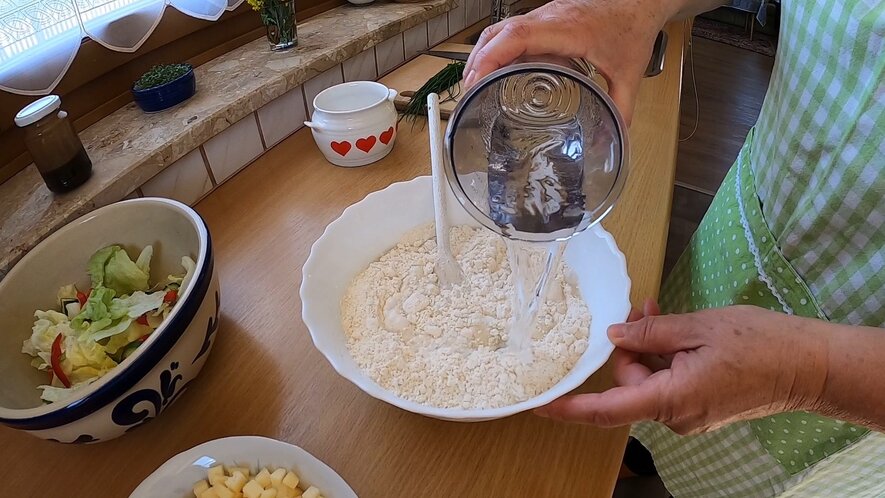
You are a GUI agent. You are given a task and a screenshot of the screen. Output one action in this format:
    pyautogui.click(x=<x>, y=<y>)
    Task: Click on the wooden floor
    Image resolution: width=885 pixels, height=498 pixels.
    Given the screenshot: What is the action you would take?
    pyautogui.click(x=718, y=75), pyautogui.click(x=711, y=141), pyautogui.click(x=694, y=202)